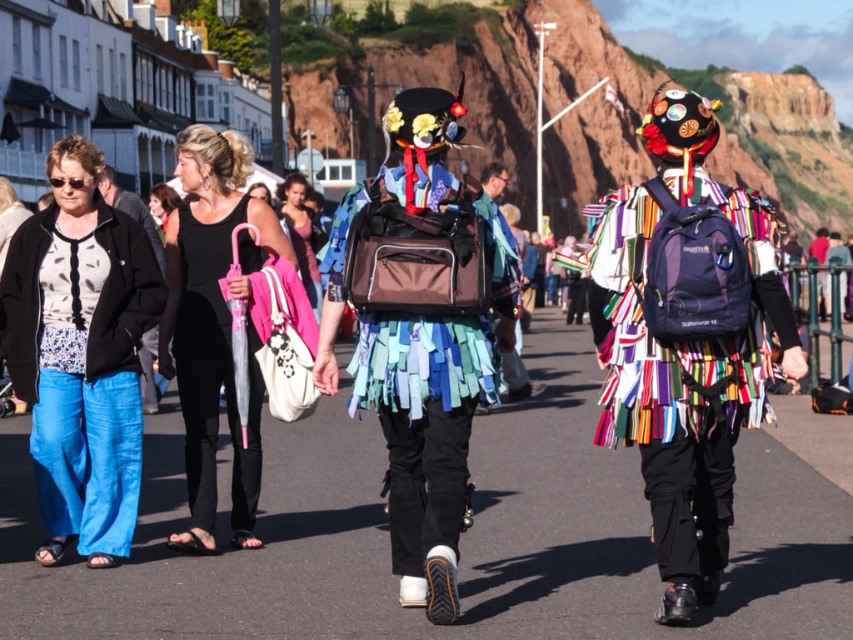
Who is shorter, denim pants at left or matte pink top at center?

matte pink top at center

The width and height of the screenshot is (853, 640). What do you see at coordinates (80, 353) in the screenshot?
I see `denim pants at left` at bounding box center [80, 353].

Find the location of a particular element. denim pants at left is located at coordinates (80, 353).

How far apart are multicolored fabric backpack at center and black fabric dress at center?

multicolored fabric backpack at center is 12.87 feet away from black fabric dress at center.

Can you confirm if multicolored fabric backpack at center is taller than black fabric dress at center?

Incorrect, multicolored fabric backpack at center's height is not larger of black fabric dress at center's.

Is point (729, 408) farther from viewer compared to point (248, 444)?

No, it is in front of (248, 444).

In order to click on multicolored fabric backpack at center in this screenshot , I will do `click(683, 369)`.

Who is positioned more to the left, black fabric dress at center or matte pink top at center?

Positioned to the left is matte pink top at center.

Is point (170, 269) closer to camera compared to point (286, 180)?

Yes, it is in front of point (286, 180).

Between point (236, 451) and point (281, 212), which one is positioned in front?

Positioned in front is point (236, 451).

Find the location of a particular element. black fabric dress at center is located at coordinates (213, 324).